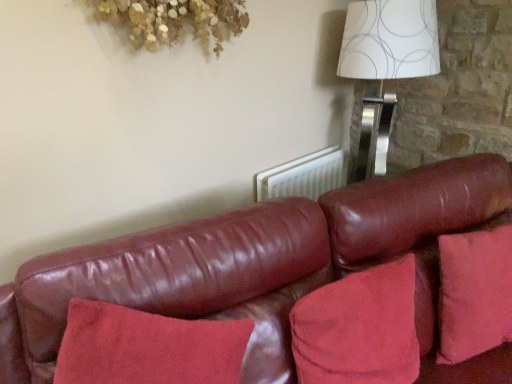
This screenshot has height=384, width=512. What do you see at coordinates (257, 262) in the screenshot?
I see `leather couch at center` at bounding box center [257, 262].

Locate an element on the screen. white paper with silver circles at upper right is located at coordinates (386, 63).

Is white paper with silver circles at upper right completely or partially inside suede-like red pillow at lower right?

No, white paper with silver circles at upper right is not a part of suede-like red pillow at lower right.

Which object is further away from the camera, suede-like red pillow at lower right or white paper with silver circles at upper right?

white paper with silver circles at upper right is more distant.

From their relative heights in the image, would you say suede-like red pillow at lower right is taller or shorter than white paper with silver circles at upper right?

Clearly, suede-like red pillow at lower right is shorter compared to white paper with silver circles at upper right.

How different are the orientations of suede-like red pillow at lower right and white paper with silver circles at upper right in degrees?

There is a 17.4-degree angle between the facing directions of suede-like red pillow at lower right and white paper with silver circles at upper right.

Is white paper with silver circles at upper right to the right of leather couch at center from the viewer's perspective?

Yes.

Would you consider white paper with silver circles at upper right to be distant from leather couch at center?

white paper with silver circles at upper right is actually quite close to leather couch at center.

Considering the sizes of objects white paper with silver circles at upper right and leather couch at center in the image provided, who is smaller, white paper with silver circles at upper right or leather couch at center?

white paper with silver circles at upper right is smaller.

Measure the distance from suede-like red pillow at lower right to leather couch at center.

They are 8.00 inches apart.

Based on the photo, would you say suede-like red pillow at lower right is outside leather couch at center?

No, most part of suede-like red pillow at lower right lies within leather couch at center.

Between suede-like red pillow at lower right and leather couch at center, which one has more height?

leather couch at center is taller.

From a real-world perspective, does suede-like red pillow at lower right stand above leather couch at center?

Yes, from a real-world perspective, suede-like red pillow at lower right is over leather couch at center

Are leather couch at center and white paper with silver circles at upper right far apart?

leather couch at center is actually quite close to white paper with silver circles at upper right.

Looking at their sizes, would you say leather couch at center is wider or thinner than white paper with silver circles at upper right?

Clearly, leather couch at center has more width compared to white paper with silver circles at upper right.

Where is `table lamp that is above the leather couch at center (from the image's perspective)`? This screenshot has width=512, height=384. table lamp that is above the leather couch at center (from the image's perspective) is located at coordinates (386, 63).

How much distance is there between leather couch at center and white paper with silver circles at upper right?

leather couch at center is 31.66 inches away from white paper with silver circles at upper right.

Is leather couch at center taller than suede-like red pillow at lower right?

Yes.

Is leather couch at center oriented away from suede-like red pillow at lower right?

Yes.

Which is behind, point (10, 288) or point (361, 314)?

Point (361, 314)

From a real-world perspective, who is located higher, leather couch at center or suede-like red pillow at lower right?

suede-like red pillow at lower right, from a real-world perspective.

In the scene shown: Between white paper with silver circles at upper right and suede-like red pillow at lower right, which one has more height?

white paper with silver circles at upper right is taller.

Is white paper with silver circles at upper right far from suede-like red pillow at lower right?

Yes, white paper with silver circles at upper right is far from suede-like red pillow at lower right.

Can you confirm if white paper with silver circles at upper right is bigger than suede-like red pillow at lower right?

Indeed, white paper with silver circles at upper right has a larger size compared to suede-like red pillow at lower right.

Considering the positions of objects white paper with silver circles at upper right and suede-like red pillow at lower right in the image provided, who is more to the left, white paper with silver circles at upper right or suede-like red pillow at lower right?

From the viewer's perspective, suede-like red pillow at lower right appears more on the left side.

You are a GUI agent. You are given a task and a screenshot of the screen. Output one action in this format:
    pyautogui.click(x=<x>, y=<y>)
    Task: Click on the pillow in front of the white paper with silver circles at upper right
    This screenshot has width=512, height=384.
    Given the screenshot: What is the action you would take?
    (359, 328)

At what (x,y) coordinates should I click in order to perform the action: click on table lamp behind the leather couch at center. Please return your answer as a coordinate pair (x, y). The image size is (512, 384). Looking at the image, I should click on (386, 63).

Which object lies nearer to the anchor point leather couch at center, white paper with silver circles at upper right or suede-like red pillow at lower right?

Among the two, suede-like red pillow at lower right is located nearer to leather couch at center.

Based on their spatial positions, is white paper with silver circles at upper right or leather couch at center closer to suede-like red pillow at lower right?

The object closer to suede-like red pillow at lower right is leather couch at center.

Considering their positions, is suede-like red pillow at lower right positioned further to white paper with silver circles at upper right than leather couch at center?

The object further to white paper with silver circles at upper right is suede-like red pillow at lower right.

Which object lies nearer to the anchor point suede-like red pillow at lower right, leather couch at center or white paper with silver circles at upper right?

leather couch at center is positioned closer to the anchor suede-like red pillow at lower right.

Which object lies further to the anchor point white paper with silver circles at upper right, leather couch at center or suede-like red pillow at lower right?

Based on the image, suede-like red pillow at lower right appears to be further to white paper with silver circles at upper right.

Based on their spatial positions, is suede-like red pillow at lower right or white paper with silver circles at upper right further from leather couch at center?

The object further to leather couch at center is white paper with silver circles at upper right.

Find the location of a particular element. The width and height of the screenshot is (512, 384). pillow positioned between leather couch at center and white paper with silver circles at upper right from near to far is located at coordinates (359, 328).